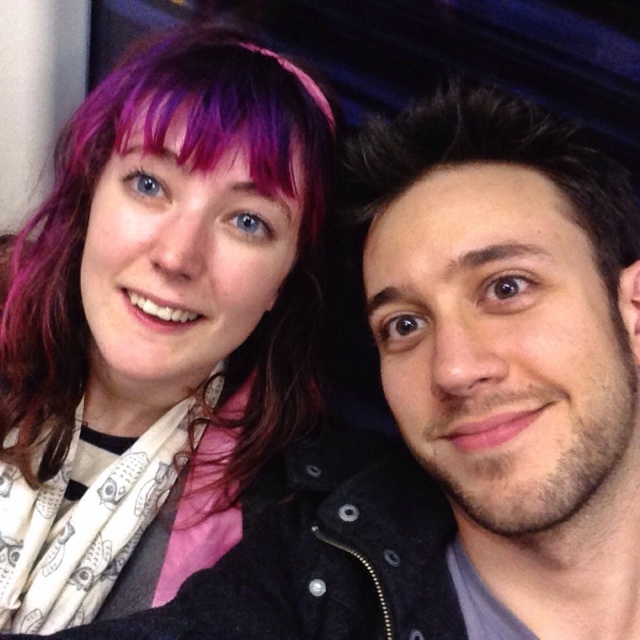
Question: Can you confirm if matte black jacket at upper left is bigger than smooth black jacket at right?

Choices:
 (A) no
 (B) yes

Answer: (B)

Question: Among these objects, which one is farthest from the camera?

Choices:
 (A) matte black jacket at upper left
 (B) smooth black jacket at right

Answer: (A)

Question: Is the position of matte black jacket at upper left more distant than that of smooth black jacket at right?

Choices:
 (A) no
 (B) yes

Answer: (B)

Question: From the image, what is the correct spatial relationship of matte black jacket at upper left in relation to smooth black jacket at right?

Choices:
 (A) left
 (B) right

Answer: (A)

Question: Which of the following is the farthest from the observer?

Choices:
 (A) (118, 308)
 (B) (568, 339)

Answer: (A)